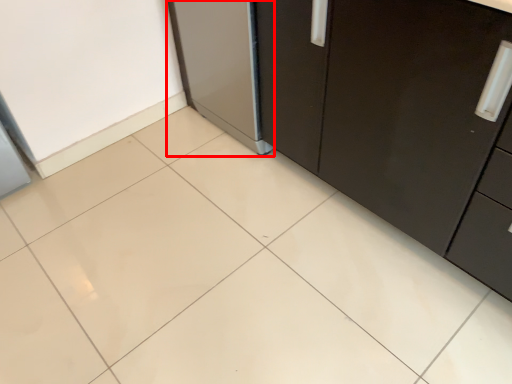
Question: From the image, what is the correct spatial relationship of appliance (annotated by the red box) in relation to cabinetry?

Choices:
 (A) left
 (B) right

Answer: (A)